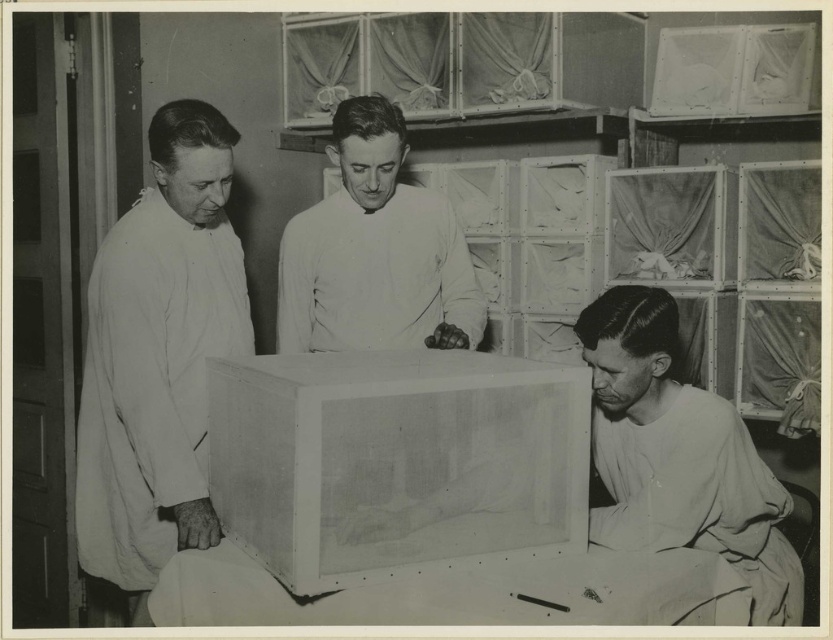
In the laboratory scene, there is a smooth white shirt at lower right and a white matte coat at center. Which of these two items is located to the right of the other?

The smooth white shirt at lower right is positioned on the right side of white matte coat at center.

You are a photographer adjusting lighting in the lab. You need to place a spotlight on the narrower object between the smooth white shirt at lower right and the white matte coat at center. Which object should you choose?

The smooth white shirt at lower right has a lesser width compared to the white matte coat at center, so you should place the spotlight on the smooth white shirt at lower right.

In the laboratory scene, there is a white cloth at left and a smooth white shirt at lower right. Which object is taller?

The white cloth at left is taller than the smooth white shirt at lower right.